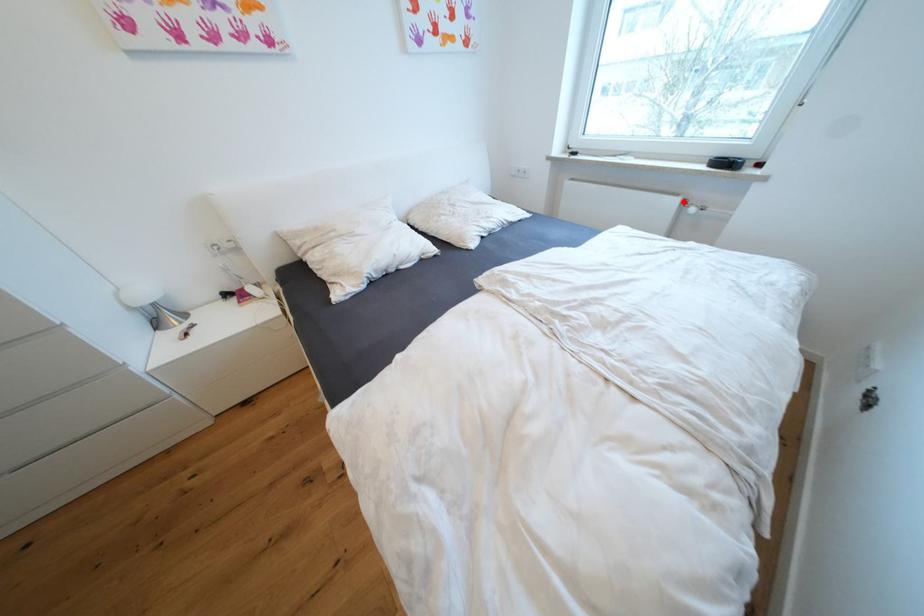
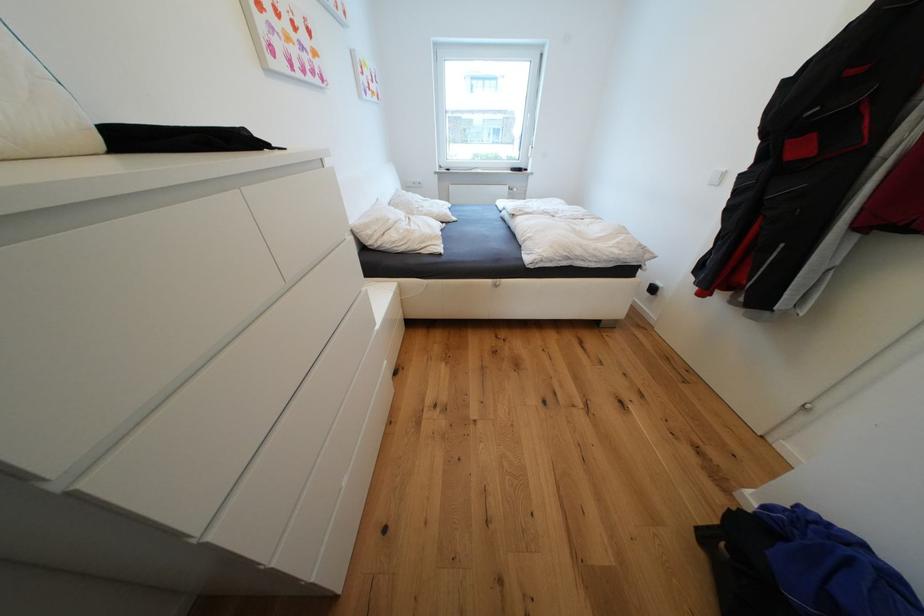
Where in the second image is the point corresponding to the highlighted location from the first image?

(515, 188)